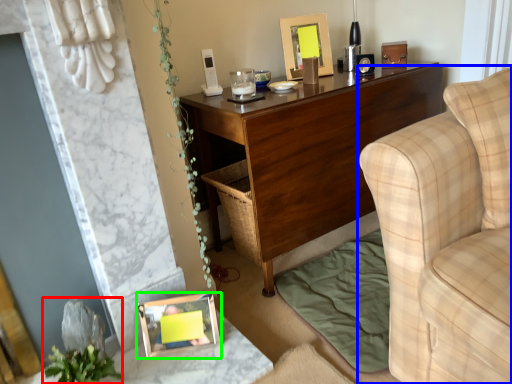
Question: Which object is positioned farthest from plant (highlighted by a red box)? Select from studio couch (highlighted by a blue box) and picture frame (highlighted by a green box).

Choices:
 (A) studio couch
 (B) picture frame

Answer: (A)